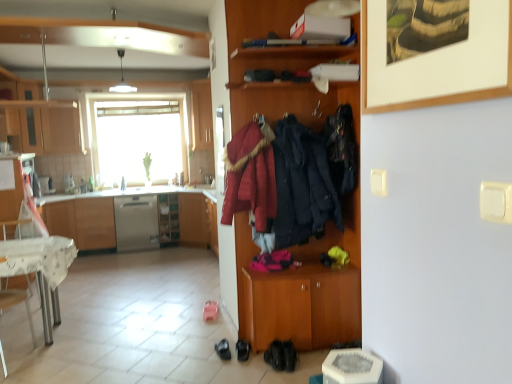
Question: Which is correct: velvet-like dark blue coat at center, which ranks as the 2th clothing in left-to-right order, is inside satin wood cabinet at left, the 2th cabinetry positioned from the right, or outside of it?

Choices:
 (A) outside
 (B) inside

Answer: (A)

Question: In terms of size, does velvet-like dark blue coat at center, which ranks as the 2th clothing in left-to-right order, appear bigger or smaller than satin wood cabinet at left, arranged as the fourth cabinetry when viewed from the front?

Choices:
 (A) small
 (B) big

Answer: (A)

Question: Which is farther from the black leather shoes at lower center, which is counted as the 1th footwear, starting from the left?

Choices:
 (A) transparent glass window at center
 (B) satin silver dishwasher at center
 (C) metallic silver cabinet at left, arranged as the third cabinetry when viewed from the right
 (D) velvet-like red coat at center, the third clothing viewed from the right
 (E) wooden cabinet at center

Answer: (A)

Question: Which object is the closest to the white glossy desk at lower left?

Choices:
 (A) satin wood cabinet at left, the 2th cabinetry positioned from the right
 (B) black leather shoes at lower center, which appears as the first footwear when viewed from the right
 (C) satin silver dishwasher at center
 (D) metallic silver cabinet at left, the 2th cabinetry from the left
 (E) black leather shoes at lower center, acting as the second footwear starting from the left

Answer: (D)